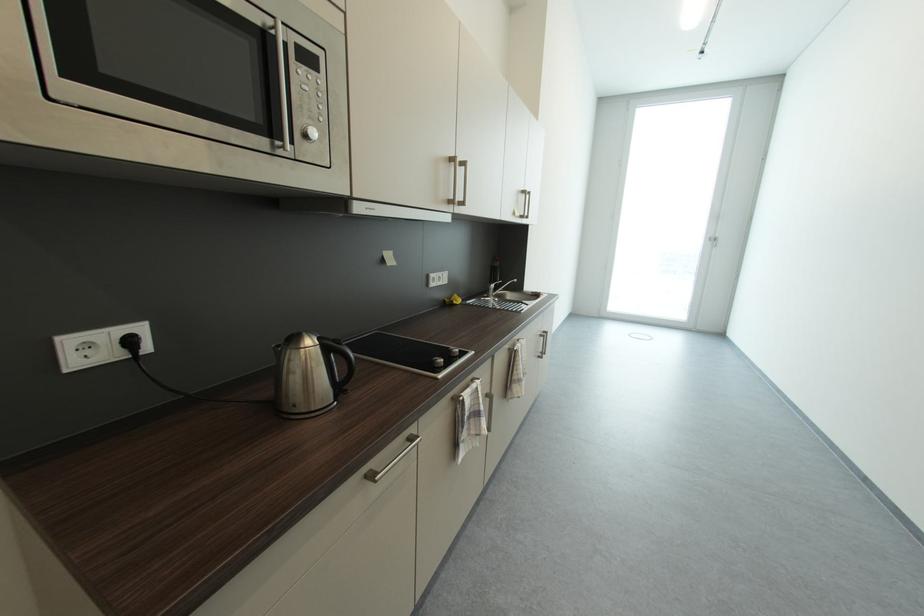
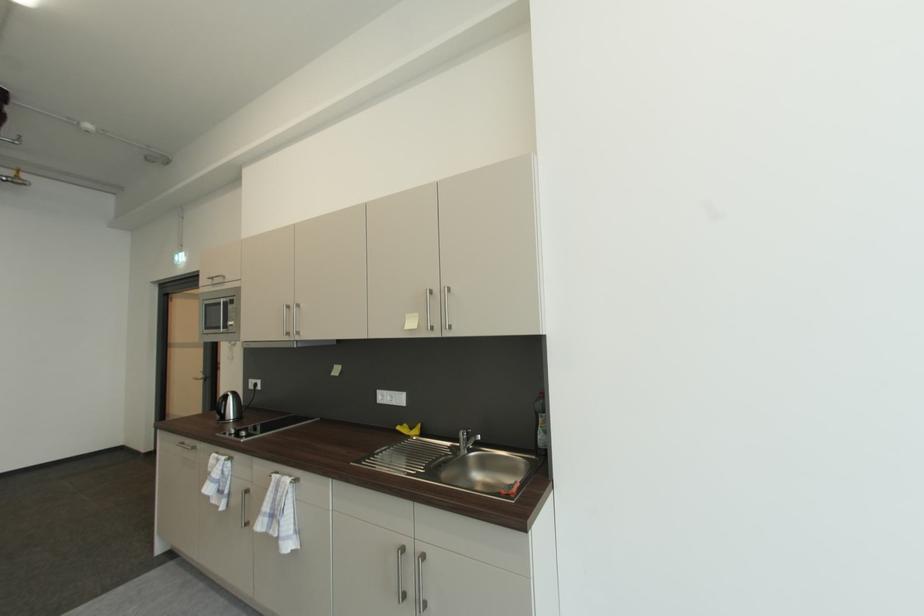
Locate, in the second image, the point that corresponds to (x=523, y=351) in the first image.

(277, 477)